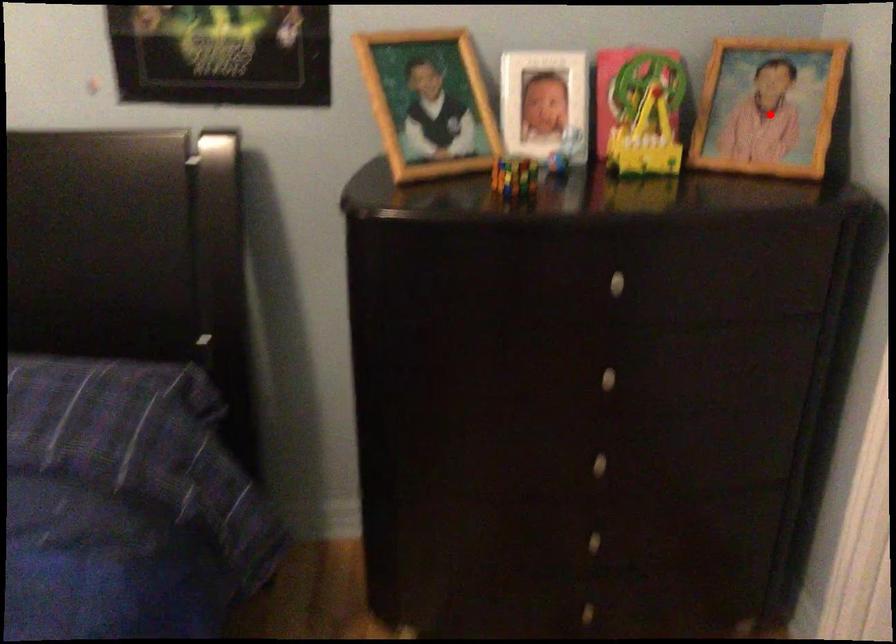
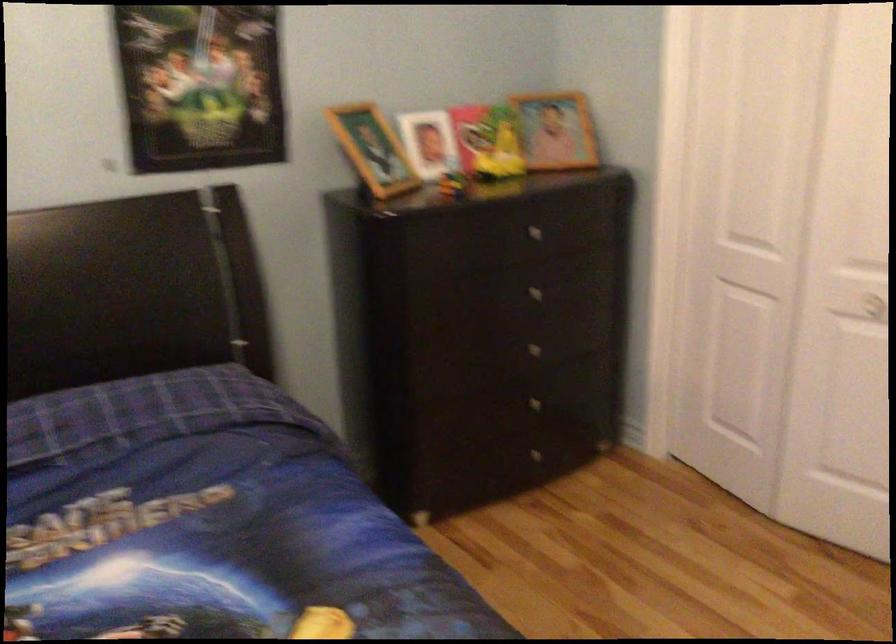
Question: I am providing you with two images of the same scene from different viewpoints. In image1, a red point is highlighted. Considering the same 3D point in image2, which of the following is correct?

Choices:
 (A) It is closer
 (B) It is farther

Answer: (B)